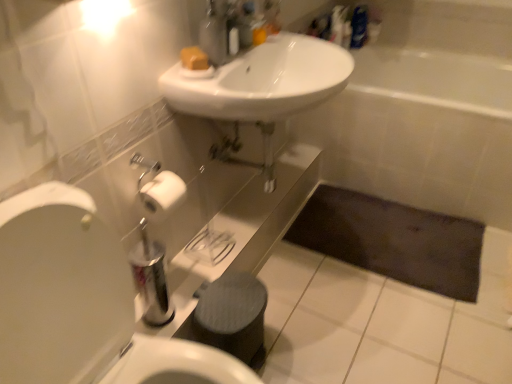
The height and width of the screenshot is (384, 512). What are the coordinates of `vacant area that is in front of dark fabric bath mat at lower center` in the screenshot? It's located at (393, 320).